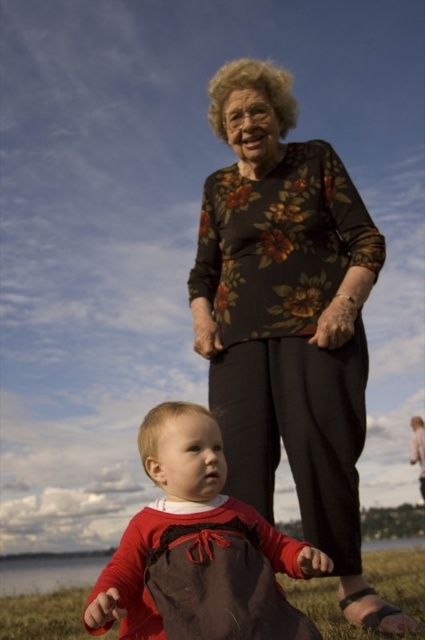
Does floral-patterned blouse at center have a smaller size compared to brown textured fabric at lower center?

Correct, floral-patterned blouse at center occupies less space than brown textured fabric at lower center.

Is floral-patterned blouse at center in front of brown textured fabric at lower center?

No, it is behind brown textured fabric at lower center.

Does point (260, 161) come closer to viewer compared to point (419, 586)?

Yes, point (260, 161) is closer to viewer.

At what (x,y) coordinates should I click in order to perform the action: click on floral-patterned blouse at center. Please return your answer as a coordinate pair (x, y). Image resolution: width=425 pixels, height=640 pixels. Looking at the image, I should click on (288, 317).

Does floral-patterned blouse at center have a larger size compared to matte red dress at center?

Indeed, floral-patterned blouse at center has a larger size compared to matte red dress at center.

Between floral-patterned blouse at center and matte red dress at center, which one appears on the right side from the viewer's perspective?

From the viewer's perspective, floral-patterned blouse at center appears more on the right side.

The width and height of the screenshot is (425, 640). What are the coordinates of `floral-patterned blouse at center` in the screenshot? It's located at (288, 317).

Does matte red dress at center lie behind brown textured fabric at lower center?

That is False.

Which is in front, point (164, 460) or point (5, 605)?

Point (164, 460) is more forward.

Where is `matte red dress at center`? The image size is (425, 640). matte red dress at center is located at coordinates (198, 547).